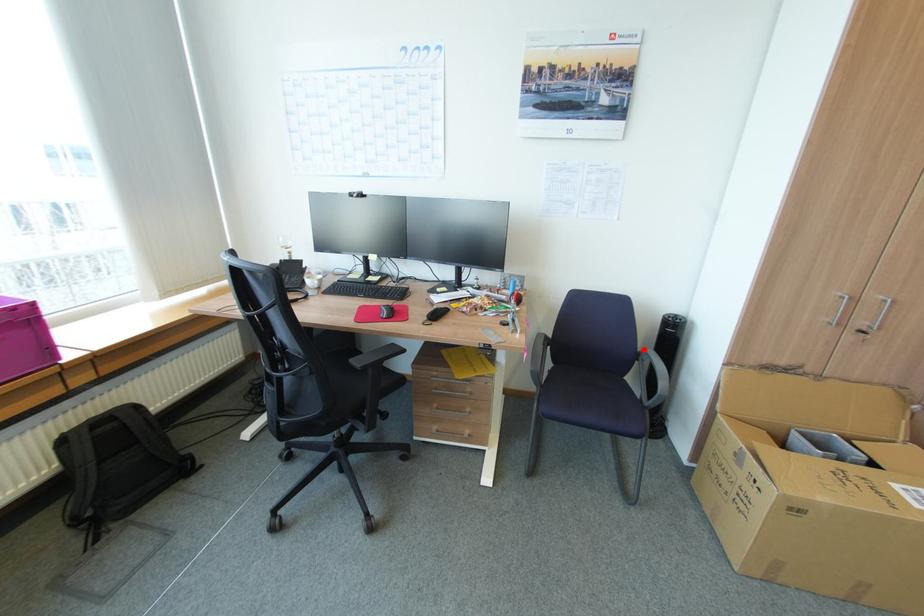
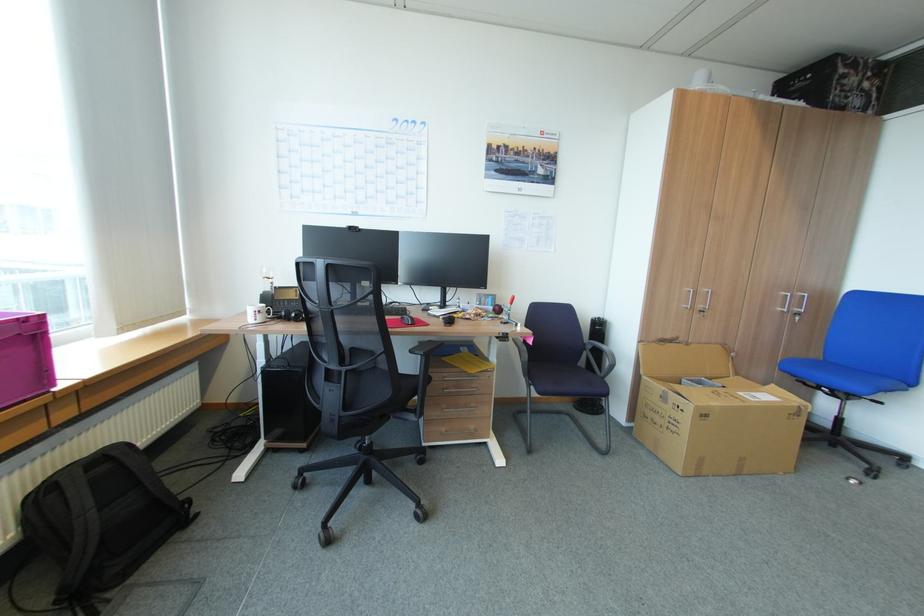
Where in the second image is the point corresponding to the highlighted location from the first image?

(590, 342)